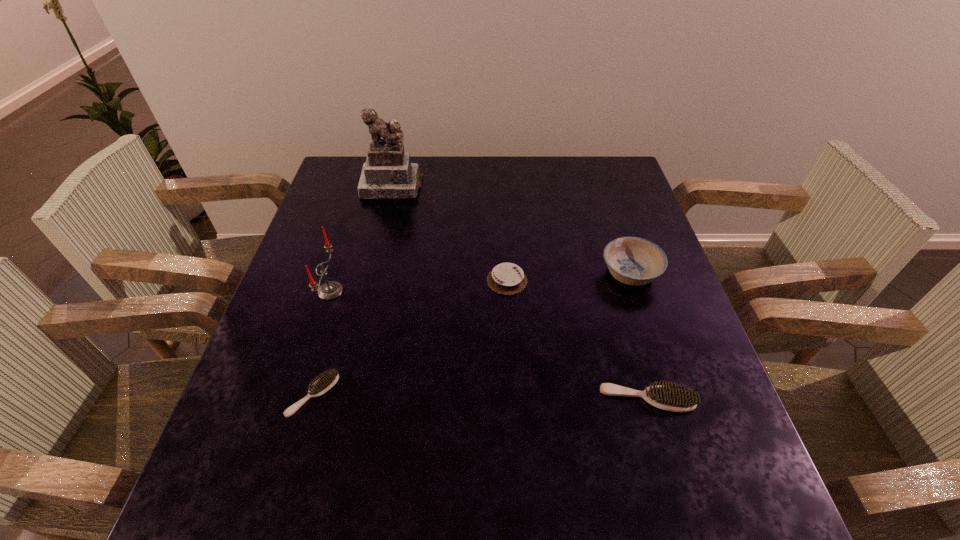
The image size is (960, 540). Find the location of `the left scrubbing brush`. the left scrubbing brush is located at coordinates (327, 380).

Where is `the right scrubbing brush`? This screenshot has height=540, width=960. the right scrubbing brush is located at coordinates (675, 398).

The image size is (960, 540). I want to click on the third shortest object, so click(675, 398).

I want to click on figurine, so click(388, 172).

Where is `the farthest object`? The width and height of the screenshot is (960, 540). the farthest object is located at coordinates (388, 172).

Identify the location of candle. Image resolution: width=960 pixels, height=540 pixels. (330, 290).

Where is `the third tallest object`? This screenshot has width=960, height=540. the third tallest object is located at coordinates (635, 261).

Locate an element on the screen. the fourth object from left to right is located at coordinates (505, 278).

You are a GUI agent. You are given a task and a screenshot of the screen. Output one action in this format:
    pyautogui.click(x=<x>, y=<y>)
    Task: Click on the blank space located on the back of the left scrubbing brush
    The image size is (960, 540).
    Given the screenshot: What is the action you would take?
    pyautogui.click(x=331, y=333)

Locate an element on the screen. vacant space located on the back of the fourth tallest object is located at coordinates (632, 344).